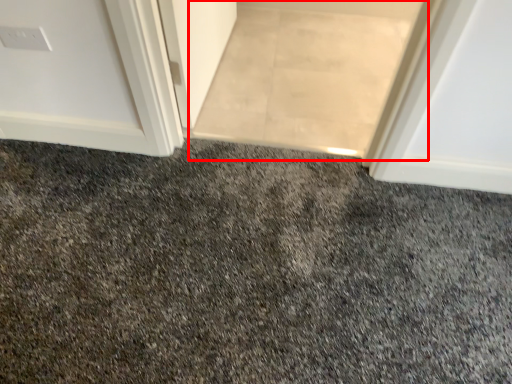
Question: From the image's perspective, considering the relative positions of doormat (annotated by the red box) and granite in the image provided, where is doormat (annotated by the red box) located with respect to the staircase?

Choices:
 (A) below
 (B) above

Answer: (B)